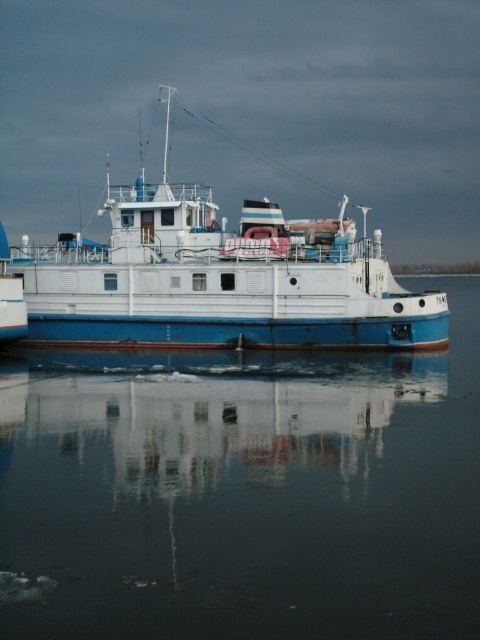
Between smooth water at center and white matte boat at center, which one has less height?

With less height is smooth water at center.

Which of these two, smooth water at center or white matte boat at center, stands taller?

Standing taller between the two is white matte boat at center.

Is point (253, 461) closer to camera compared to point (83, 260)?

Yes, it is.

Identify the location of smooth water at center. This screenshot has width=480, height=640. (247, 496).